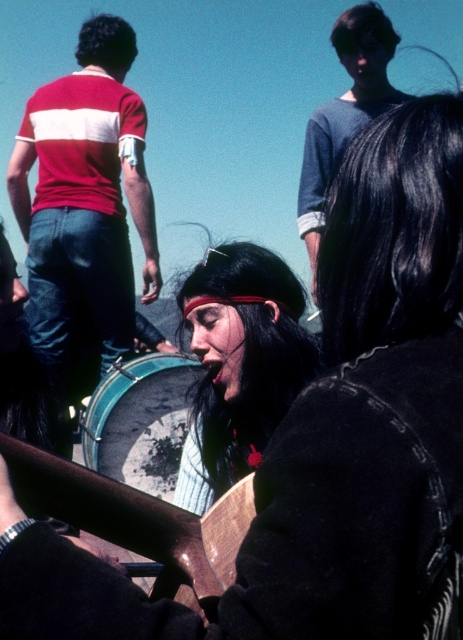
Question: Does matte black headband at center have a larger size compared to wooden book at center?

Choices:
 (A) yes
 (B) no

Answer: (A)

Question: Can you confirm if black silky hair at upper right is bigger than matte black headband at center?

Choices:
 (A) no
 (B) yes

Answer: (A)

Question: Which point is farther from the camera taking this photo?

Choices:
 (A) (x=113, y=376)
 (B) (x=93, y=518)
 (C) (x=381, y=51)

Answer: (C)

Question: Which point appears farthest from the camera in this image?

Choices:
 (A) click(x=101, y=44)
 (B) click(x=206, y=448)
 (C) click(x=162, y=362)
 (D) click(x=375, y=278)

Answer: (A)

Question: Which point is closer to the camera?

Choices:
 (A) (362, 51)
 (B) (219, 404)
 (C) (176, 538)
 (D) (341, 358)

Answer: (C)

Question: Does red striped t-shirt at left appear on the left side of blue metallic drum at center?

Choices:
 (A) no
 (B) yes

Answer: (B)